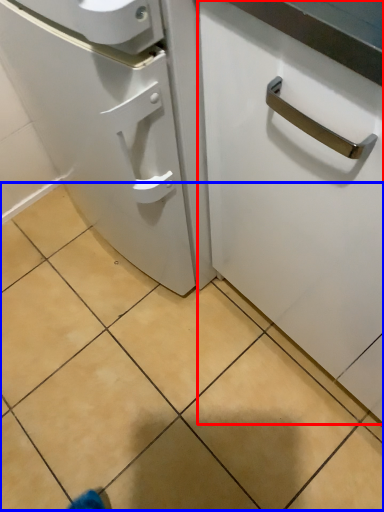
Question: Which point is further to the camera, cabinetry (highlighted by a red box) or tile (highlighted by a blue box)?

Choices:
 (A) cabinetry
 (B) tile

Answer: (B)